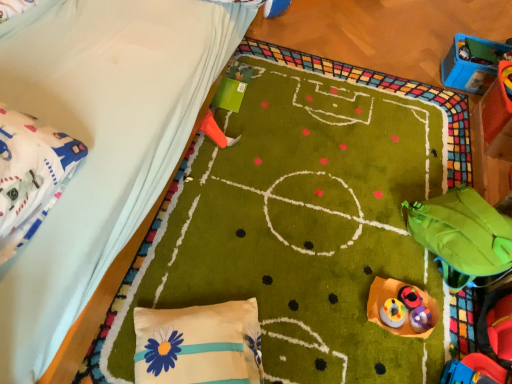
Locate an element on the screen. The image size is (512, 384). rubberized yellow toy at center, arranged as the second toy when viewed from the front is located at coordinates (393, 313).

You are a GUI agent. You are given a task and a screenshot of the screen. Output one action in this format:
    pyautogui.click(x=<x>, y=<y>)
    Task: Click on the white satin pillow with blue flower at lower center
    The height and width of the screenshot is (384, 512).
    Given the screenshot: What is the action you would take?
    [x=199, y=344]

What are the coordinates of `blue plastic toy at upper right, acting as the sixth toy starting from the front` in the screenshot? It's located at (472, 63).

In the scene shown: From the image's perspective, is white fabric at left located above or below rubberized plastic toy at lower right, which appears as the 3th toy when viewed from the front?

Clearly, from the image's perspective, white fabric at left is above rubberized plastic toy at lower right, which appears as the 3th toy when viewed from the front.

Is white fabric at left smaller than rubberized plastic toy at lower right, the 1th toy when ordered from bottom to top?

No.

Could you measure the distance between white fabric at left and rubberized plastic toy at lower right, placed as the 2th toy when sorted from right to left?

A distance of 1.12 meters exists between white fabric at left and rubberized plastic toy at lower right, placed as the 2th toy when sorted from right to left.

Is white fabric at left aimed at rubberized plastic toy at lower right, the 1th toy when ordered from bottom to top?

No, white fabric at left is not oriented towards rubberized plastic toy at lower right, the 1th toy when ordered from bottom to top.

From the image's perspective, would you say orange plastic cone at upper center, positioned as the 5th toy in bottom-to-top order, is shown under rubberized yellow toy at center, arranged as the second toy when viewed from the left?

No, from the image's perspective, orange plastic cone at upper center, positioned as the 5th toy in bottom-to-top order, is not beneath rubberized yellow toy at center, arranged as the second toy when viewed from the left.

Locate an element on the screen. The height and width of the screenshot is (384, 512). the 1st toy directly above the rubberized yellow toy at center, which is the fourth toy in top-to-bottom order (from a real-world perspective) is located at coordinates (216, 131).

Is orange plastic cone at upper center, which is counted as the 2th toy, starting from the top, far away from rubberized yellow toy at center, the 3th toy in the bottom-to-top sequence?

No, there isn't a large distance between orange plastic cone at upper center, which is counted as the 2th toy, starting from the top, and rubberized yellow toy at center, the 3th toy in the bottom-to-top sequence.

Between orange plastic cone at upper center, marked as the 2th toy in a back-to-front arrangement, and rubberized yellow toy at center, which appears as the fifth toy when viewed from the right, which one has larger width?

Wider between the two is orange plastic cone at upper center, marked as the 2th toy in a back-to-front arrangement.

Who is smaller, rubberized yellow toy at center, the 5th toy in the back-to-front sequence, or green fabric bean bag at lower right?

rubberized yellow toy at center, the 5th toy in the back-to-front sequence, is smaller.

Is point (397, 326) more distant than point (448, 282)?

No, it is in front of (448, 282).

Identify the location of bean bag chair located above the rubberized yellow toy at center, the 3th toy in the bottom-to-top sequence (from the image's perspective). (462, 236).

From a real-world perspective, who is located lower, matte plastic toy at lower right, the 6th toy from the back, or rubberized plastic toy at center, which is the 4th toy in left-to-right order?

rubberized plastic toy at center, which is the 4th toy in left-to-right order, from a real-world perspective.

Which of these two, matte plastic toy at lower right, the third toy in the left-to-right sequence, or rubberized plastic toy at center, the fourth toy in the front-to-back sequence, stands taller?

rubberized plastic toy at center, the fourth toy in the front-to-back sequence, is taller.

Which object is closer to the camera taking this photo, matte plastic toy at lower right, marked as the 2th toy in a bottom-to-top arrangement, or rubberized plastic toy at center, the third toy when ordered from back to front?

matte plastic toy at lower right, marked as the 2th toy in a bottom-to-top arrangement.

Where is `the 3rd toy in front of the rubberized plastic toy at center, the third toy positioned from the top, starting your count from the anchor`? the 3rd toy in front of the rubberized plastic toy at center, the third toy positioned from the top, starting your count from the anchor is located at coordinates coord(395,297).

Which of these two, blue plastic toy at upper right, which appears as the 1th toy when viewed from the top, or orange plastic cone at upper center, which is the fifth toy from front to back, is smaller?

orange plastic cone at upper center, which is the fifth toy from front to back.

How different are the orientations of blue plastic toy at upper right, marked as the first toy in a right-to-left arrangement, and orange plastic cone at upper center, marked as the 2th toy in a back-to-front arrangement, in degrees?

The angle between the facing direction of blue plastic toy at upper right, marked as the first toy in a right-to-left arrangement, and the facing direction of orange plastic cone at upper center, marked as the 2th toy in a back-to-front arrangement, is 176 degrees.

From a real-world perspective, is blue plastic toy at upper right, the 1th toy when ordered from back to front, on top of orange plastic cone at upper center, marked as the 2th toy in a back-to-front arrangement?

Correct, in the physical world, blue plastic toy at upper right, the 1th toy when ordered from back to front, is higher than orange plastic cone at upper center, marked as the 2th toy in a back-to-front arrangement.

Is blue plastic toy at upper right, the sixth toy viewed from the left, next to orange plastic cone at upper center, which is counted as the 2th toy, starting from the top?

No, blue plastic toy at upper right, the sixth toy viewed from the left, is not making contact with orange plastic cone at upper center, which is counted as the 2th toy, starting from the top.

Which of these two, matte plastic toy at lower right, the third toy in the left-to-right sequence, or rubberized plastic toy at lower right, the 1th toy when ordered from bottom to top, is wider?

Wider between the two is matte plastic toy at lower right, the third toy in the left-to-right sequence.

From a real-world perspective, is matte plastic toy at lower right, the 6th toy from the back, under rubberized plastic toy at lower right, marked as the fourth toy in a back-to-front arrangement?

No.

Based on the photo, is matte plastic toy at lower right, which appears as the 5th toy when viewed from the top, next to rubberized plastic toy at lower right, marked as the fourth toy in a back-to-front arrangement?

Yes, matte plastic toy at lower right, which appears as the 5th toy when viewed from the top, is in contact with rubberized plastic toy at lower right, marked as the fourth toy in a back-to-front arrangement.

Is matte plastic toy at lower right, which appears as the 1th toy when viewed from the front, inside the boundaries of rubberized plastic toy at lower right, positioned as the fifth toy in left-to-right order, or outside?

matte plastic toy at lower right, which appears as the 1th toy when viewed from the front, is spatially situated outside rubberized plastic toy at lower right, positioned as the fifth toy in left-to-right order.

Is rubberized yellow toy at center, which is the fourth toy in top-to-bottom order, oriented away from matte plastic toy at lower right, which appears as the 5th toy when viewed from the top?

Yes.

Are rubberized yellow toy at center, arranged as the second toy when viewed from the front, and matte plastic toy at lower right, the 6th toy from the back, located far from each other?

No.

Which of these two, rubberized yellow toy at center, arranged as the second toy when viewed from the front, or matte plastic toy at lower right, marked as the 2th toy in a bottom-to-top arrangement, stands taller?

With more height is rubberized yellow toy at center, arranged as the second toy when viewed from the front.

Locate an element on the screen. Image resolution: width=512 pixels, height=384 pixels. material above the rubberized plastic toy at lower right, the 1th toy when ordered from bottom to top (from the image's perspective) is located at coordinates (31, 175).

Identify the location of the 1st toy located above the rubberized yellow toy at center, which appears as the fifth toy when viewed from the right (from a real-world perspective). The height and width of the screenshot is (384, 512). (216, 131).

Which object lies further to the anchor point matte plastic toy at lower right, marked as the fourth toy in a right-to-left arrangement, white satin pillow with blue flower at lower center or orange plastic cone at upper center, the 6th toy in the right-to-left sequence?

Based on the image, orange plastic cone at upper center, the 6th toy in the right-to-left sequence, appears to be further to matte plastic toy at lower right, marked as the fourth toy in a right-to-left arrangement.

Looking at the image, which one is located further to rubberized yellow toy at center, arranged as the second toy when viewed from the left, rubberized plastic toy at center, the third toy positioned from the top, or blue plastic toy at upper right, which ranks as the sixth toy in bottom-to-top order?

blue plastic toy at upper right, which ranks as the sixth toy in bottom-to-top order.

When comparing their distances from blue plastic toy at upper right, which appears as the 1th toy when viewed from the top, does orange plastic cone at upper center, which is the fifth toy from front to back, or white satin pillow with blue flower at lower center seem further?

white satin pillow with blue flower at lower center is positioned further to the anchor blue plastic toy at upper right, which appears as the 1th toy when viewed from the top.

Estimate the real-world distances between objects in this image. Which object is further from rubberized plastic toy at lower right, which appears as the 3th toy when viewed from the front, white fabric at left or green fabric bean bag at lower right?

white fabric at left lies further to rubberized plastic toy at lower right, which appears as the 3th toy when viewed from the front, than the other object.

Considering their positions, is rubberized plastic toy at lower right, which appears as the 3th toy when viewed from the front, positioned closer to green fabric bean bag at lower right than rubberized yellow toy at center, the 3th toy in the bottom-to-top sequence?

The object closer to green fabric bean bag at lower right is rubberized plastic toy at lower right, which appears as the 3th toy when viewed from the front.

Looking at the image, which one is located closer to matte plastic toy at lower right, the third toy in the left-to-right sequence, white fabric at left or rubberized plastic toy at lower right, the 1th toy when ordered from bottom to top?

Among the two, rubberized plastic toy at lower right, the 1th toy when ordered from bottom to top, is located nearer to matte plastic toy at lower right, the third toy in the left-to-right sequence.

Based on their spatial positions, is matte plastic toy at lower right, which appears as the 1th toy when viewed from the front, or white satin pillow with blue flower at lower center further from rubberized yellow toy at center, the 3th toy in the bottom-to-top sequence?

The object further to rubberized yellow toy at center, the 3th toy in the bottom-to-top sequence, is white satin pillow with blue flower at lower center.

From the image, which object appears to be nearer to white satin pillow with blue flower at lower center, blue plastic toy at upper right, the 1th toy when ordered from back to front, or rubberized yellow toy at center, the 3th toy in the bottom-to-top sequence?

rubberized yellow toy at center, the 3th toy in the bottom-to-top sequence, lies closer to white satin pillow with blue flower at lower center than the other object.

The width and height of the screenshot is (512, 384). I want to click on toy between white satin pillow with blue flower at lower center and matte plastic toy at lower right, which appears as the 5th toy when viewed from the top, so click(393, 313).

This screenshot has height=384, width=512. In order to click on bean bag chair between white fabric at left and blue plastic toy at upper right, the sixth toy viewed from the left, in the horizontal direction in this screenshot , I will do point(462,236).

This screenshot has height=384, width=512. Find the location of `pillow located between white fabric at left and blue plastic toy at upper right, the sixth toy viewed from the left, in the left-right direction`. pillow located between white fabric at left and blue plastic toy at upper right, the sixth toy viewed from the left, in the left-right direction is located at coordinates point(199,344).

Where is `bean bag chair between white satin pillow with blue flower at lower center and blue plastic toy at upper right, which appears as the 1th toy when viewed from the top, from left to right`? Image resolution: width=512 pixels, height=384 pixels. bean bag chair between white satin pillow with blue flower at lower center and blue plastic toy at upper right, which appears as the 1th toy when viewed from the top, from left to right is located at coordinates (462, 236).